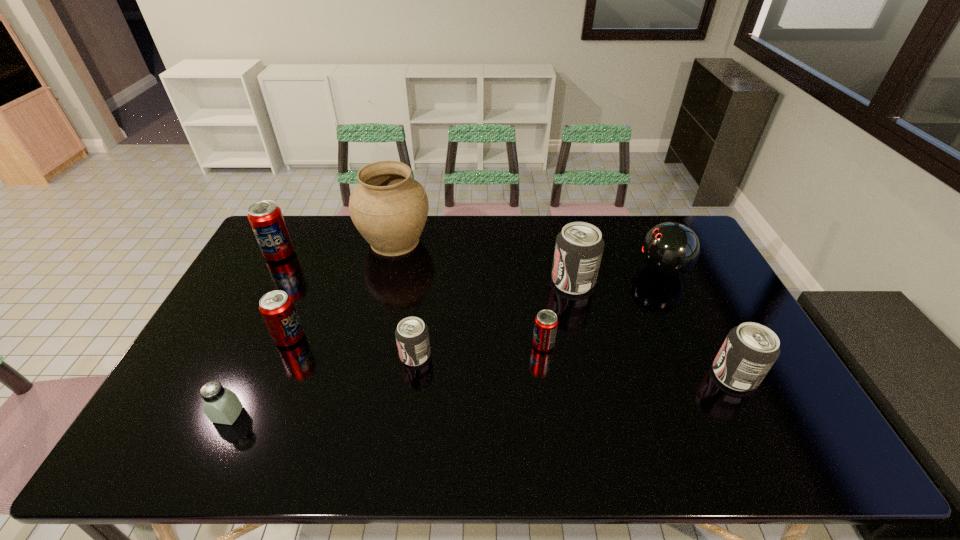
Identify the location of free space between the farthest red soda can and the seventh object from left to right. Image resolution: width=960 pixels, height=540 pixels. (426, 268).

Find the location of a particular element. The width and height of the screenshot is (960, 540). object that is the sixth closest to the leftmost black soda can is located at coordinates [x=266, y=219].

Identify which object is the third closest to the fifth soda can from left to right. Please provide its 2D coordinates. Your answer should be formatted as a tuple, i.e. [(x, y)], where the tuple contains the x and y coordinates of a point satisfying the conditions above.

[(750, 350)]

Where is `soda can that can be found as the third closest to the smallest black soda can`? Image resolution: width=960 pixels, height=540 pixels. soda can that can be found as the third closest to the smallest black soda can is located at coordinates (579, 247).

What are the coordinates of `soda can that can be found as the second closest to the smallest black soda can` in the screenshot? It's located at (546, 321).

Find the location of `black soda can that is the second closest to the second biggest black soda can`. black soda can that is the second closest to the second biggest black soda can is located at coordinates (412, 337).

This screenshot has width=960, height=540. Identify the location of black soda can that is the closest to the leftmost red soda can. (412, 337).

Locate which red soda can is the closest to the third object from left to right. Please provide its 2D coordinates. Your answer should be formatted as a tuple, i.e. [(x, y)], where the tuple contains the x and y coordinates of a point satisfying the conditions above.

[(266, 219)]

Identify which red soda can is the second nearest to the tallest object. Please provide its 2D coordinates. Your answer should be formatted as a tuple, i.e. [(x, y)], where the tuple contains the x and y coordinates of a point satisfying the conditions above.

[(277, 309)]